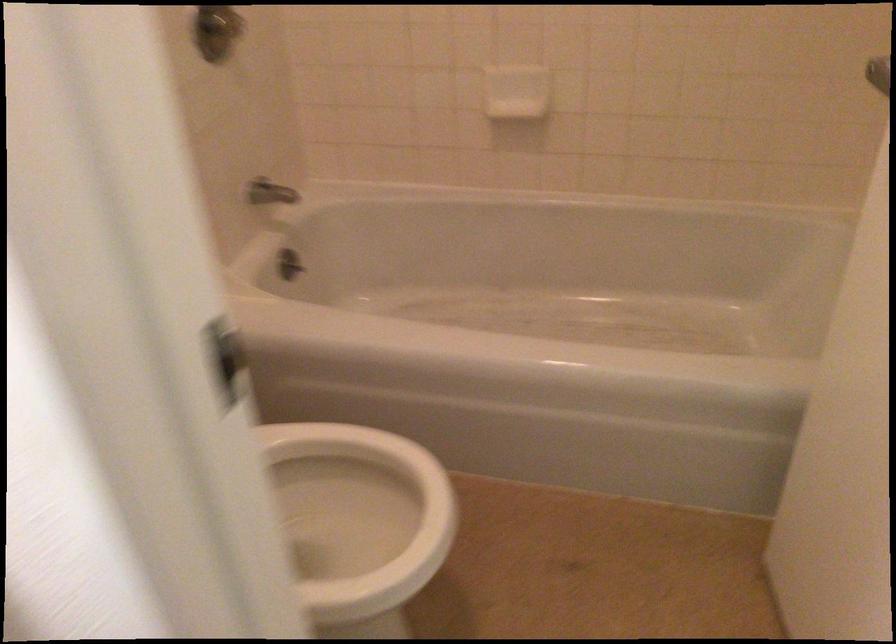
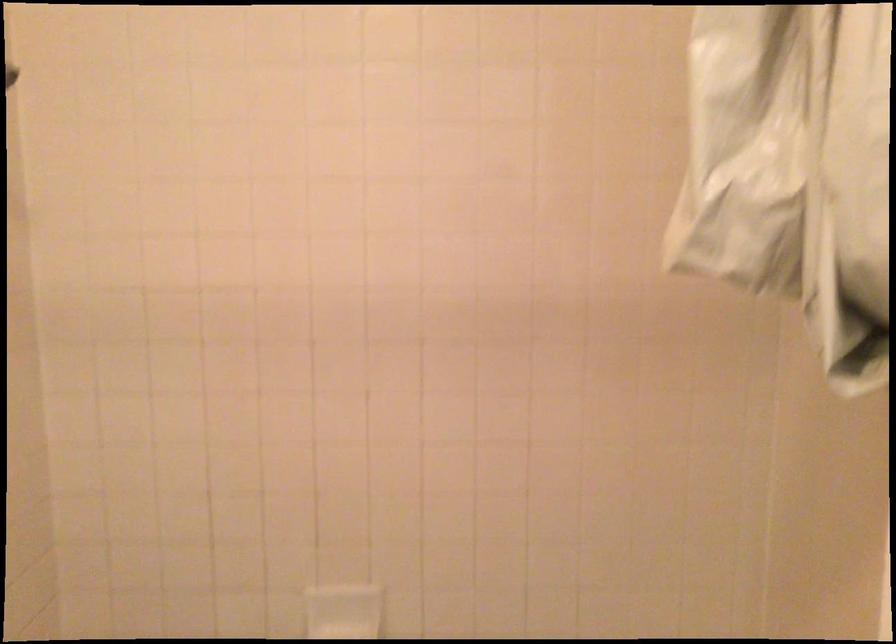
Question: What movement of the cameraman would produce the second image?

Choices:
 (A) Left
 (B) Right
 (C) Forward
 (D) Backward

Answer: (C)